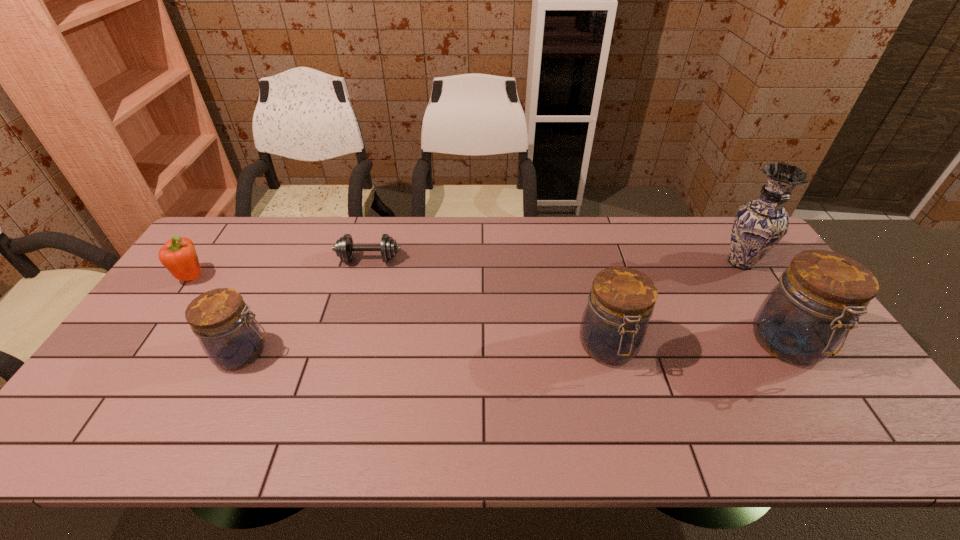
Find the location of a particular element. The width and height of the screenshot is (960, 540). object at the far right corner is located at coordinates (759, 225).

Where is `free location at the far edge of the desktop`? This screenshot has height=540, width=960. free location at the far edge of the desktop is located at coordinates (578, 237).

Locate an element on the screen. The width and height of the screenshot is (960, 540). vacant point at the near edge is located at coordinates (365, 397).

Image resolution: width=960 pixels, height=540 pixels. Find the location of `free location at the left edge`. free location at the left edge is located at coordinates (186, 305).

In the image, there is a desktop. Identify the location of vacant space at the near right corner. (840, 404).

This screenshot has height=540, width=960. I want to click on free space between the vase and the shortest jar, so click(492, 307).

Identify the location of vacant space in between the rightmost jar and the dumbbell. This screenshot has width=960, height=540. (579, 302).

Where is `vacant region between the second jar from left to right and the leftmost object`? This screenshot has width=960, height=540. vacant region between the second jar from left to right and the leftmost object is located at coordinates click(401, 312).

Locate an element on the screen. This screenshot has width=960, height=540. free space between the tallest object and the second tallest jar is located at coordinates (674, 305).

At what (x,y) coordinates should I click in order to perform the action: click on vacant area that lies between the second object from left to right and the vase. Please return your answer as a coordinate pair (x, y). This screenshot has height=540, width=960. Looking at the image, I should click on (492, 307).